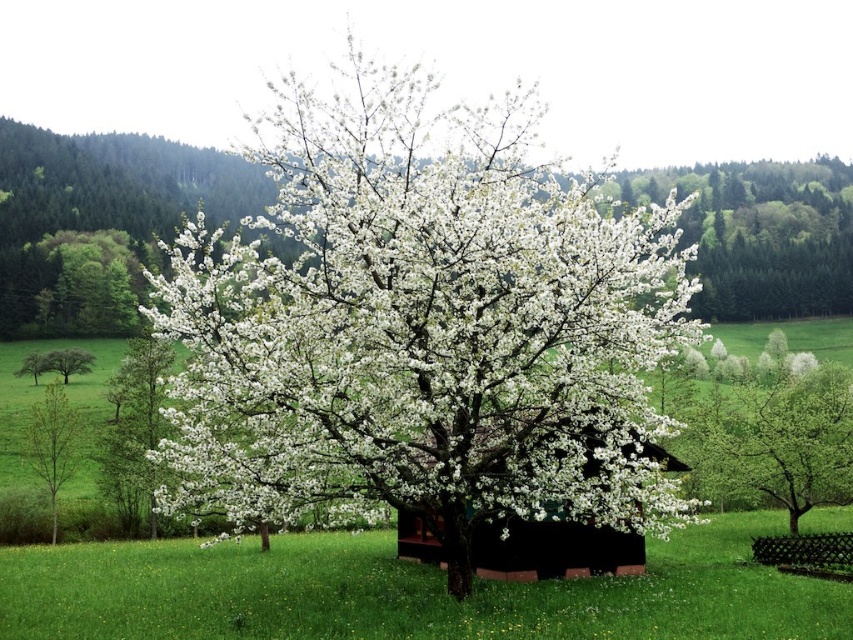
Measure the distance between point (247, 156) and camera.

18.15 meters

Can you confirm if white matte tree at center is positioned to the right of black wood hut at center?

In fact, white matte tree at center is to the left of black wood hut at center.

Where is `white matte tree at center`? white matte tree at center is located at coordinates (421, 326).

Does green smooth tree at left appear under green matte tree at left?

Yes.

Does green smooth tree at left have a smaller size compared to green matte tree at left?

No, green smooth tree at left is not smaller than green matte tree at left.

Describe the element at coordinates (51, 444) in the screenshot. The width and height of the screenshot is (853, 640). I see `green smooth tree at left` at that location.

Locate an element on the screen. The height and width of the screenshot is (640, 853). green smooth tree at left is located at coordinates (51, 444).

Is the position of white matte tree at center less distant than that of green smooth tree at left?

That is True.

How far apart are white matte tree at center and green smooth tree at left?

white matte tree at center is 26.20 meters from green smooth tree at left.

Does point (194, 467) lie in front of point (39, 467)?

Yes, point (194, 467) is in front of point (39, 467).

At what (x,y) coordinates should I click in order to perform the action: click on white matte tree at center. Please return your answer as a coordinate pair (x, y). Image resolution: width=853 pixels, height=640 pixels. Looking at the image, I should click on (421, 326).